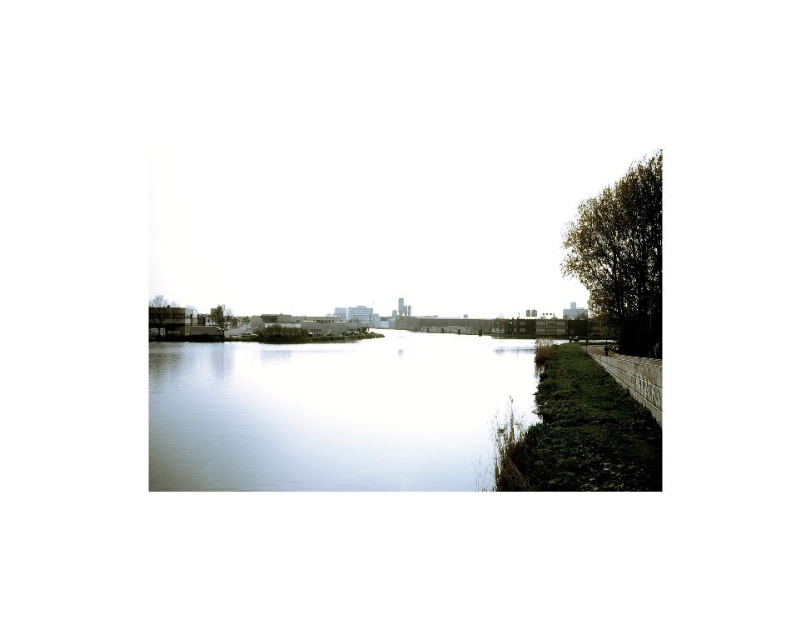
Who is shorter, smooth water at center or green leafy tree at left?

Standing shorter between the two is green leafy tree at left.

Is smooth water at center below green leafy tree at left?

Yes, smooth water at center is below green leafy tree at left.

Is point (464, 419) positioned in front of point (219, 332)?

Yes, point (464, 419) is in front of point (219, 332).

Find the location of a particular element. This screenshot has width=811, height=640. smooth water at center is located at coordinates (333, 412).

Which is below, green leafy tree at right or green leafy tree at left?

green leafy tree at left is lower down.

Who is taller, green leafy tree at right or green leafy tree at left?

green leafy tree at right

Who is more distant from viewer, [638,234] or [209,310]?

The point [209,310] is behind.

The width and height of the screenshot is (811, 640). I want to click on green leafy tree at right, so click(621, 257).

Which is below, smooth water at center or green leafy tree at right?

smooth water at center

Is smooth water at center to the left of green leafy tree at right from the viewer's perspective?

Yes, smooth water at center is to the left of green leafy tree at right.

Identify the location of smooth water at center. (333, 412).